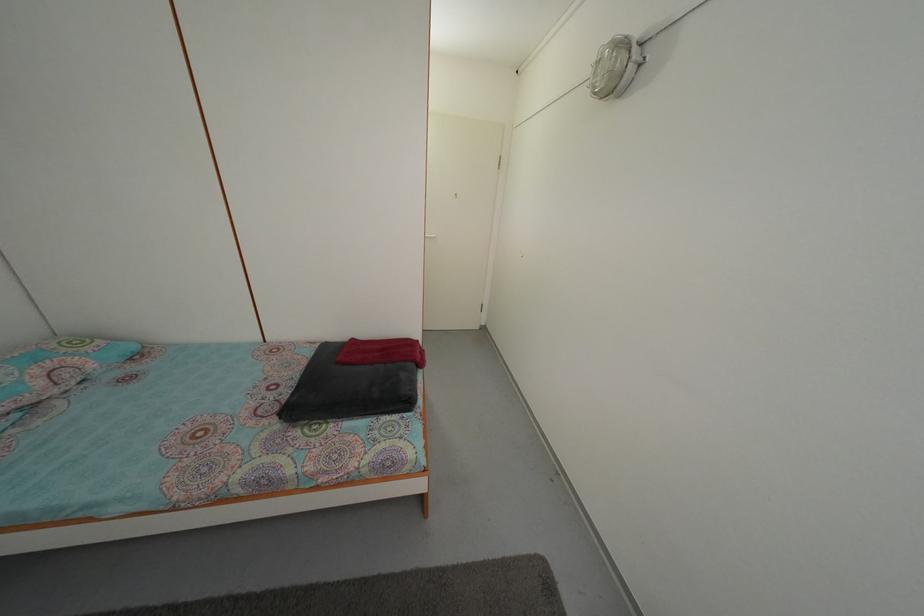
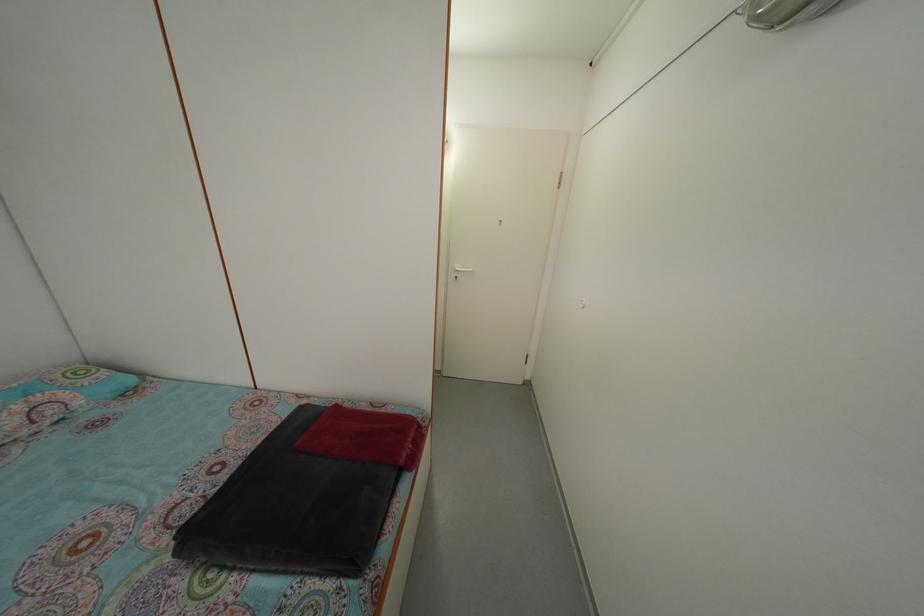
Question: The camera is either moving clockwise (left) or counter-clockwise (right) around the object. The first image is from the beginning of the video and the second image is from the end. Is the camera moving left or right when shooting the video?

Choices:
 (A) Left
 (B) Right

Answer: (B)